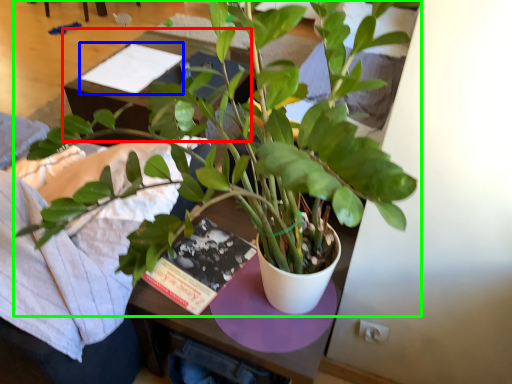
Question: Considering the real-world distances, which object is closest to table (highlighted by a red box)? book (highlighted by a blue box) or houseplant (highlighted by a green box).

Choices:
 (A) book
 (B) houseplant

Answer: (A)